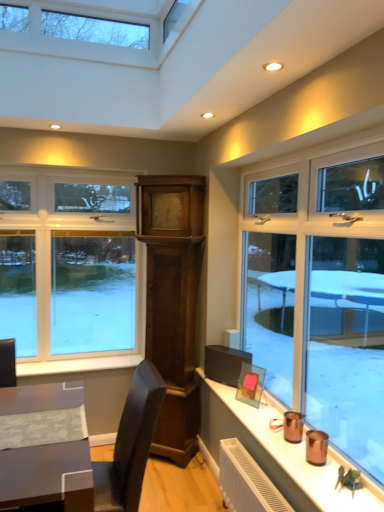
Question: Is clear glass window at left surrounded by white wood window sill at lower left?

Choices:
 (A) yes
 (B) no

Answer: (B)

Question: From a real-world perspective, is white wood window sill at lower left positioned under clear glass window at left based on gravity?

Choices:
 (A) yes
 (B) no

Answer: (A)

Question: Is white wood window sill at lower left turned away from clear glass window at left?

Choices:
 (A) yes
 (B) no

Answer: (B)

Question: Is white wood window sill at lower left at the right side of clear glass window at left?

Choices:
 (A) no
 (B) yes

Answer: (B)

Question: Is there a large distance between white wood window sill at lower left and clear glass window at left?

Choices:
 (A) yes
 (B) no

Answer: (B)

Question: Considering the relative positions of white wood window sill at lower left and clear glass window at left in the image provided, is white wood window sill at lower left in front of clear glass window at left?

Choices:
 (A) no
 (B) yes

Answer: (B)

Question: Is clear glass window at left shorter than white wood window sill at lower left?

Choices:
 (A) no
 (B) yes

Answer: (A)

Question: Is white wood window sill at lower left surrounded by clear glass window at left?

Choices:
 (A) yes
 (B) no

Answer: (B)

Question: Is clear glass window at left taller than white wood window sill at lower left?

Choices:
 (A) yes
 (B) no

Answer: (A)

Question: Is clear glass window at left oriented towards white wood window sill at lower left?

Choices:
 (A) no
 (B) yes

Answer: (B)

Question: Is clear glass window at left to the right of white wood window sill at lower left from the viewer's perspective?

Choices:
 (A) yes
 (B) no

Answer: (B)

Question: Is clear glass window at left to the left of white wood window sill at lower left from the viewer's perspective?

Choices:
 (A) no
 (B) yes

Answer: (B)

Question: Is white wood window sill at lower left bigger or smaller than clear glass window at left?

Choices:
 (A) big
 (B) small

Answer: (B)